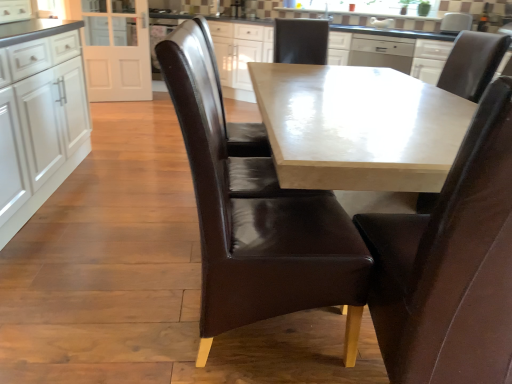
The width and height of the screenshot is (512, 384). Identify the location of blank space to the left of brown leather chair at center, placed as the 1th chair when sorted from left to right. (155, 205).